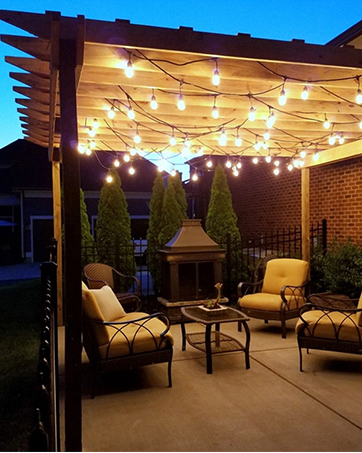
You are a GUI agent. You are given a task and a screenshot of the screen. Output one action in this format:
    pyautogui.click(x=<x>, y=<y>)
    Task: Click on the oven
    This screenshot has width=362, height=453.
    Given the screenshot: What is the action you would take?
    pyautogui.click(x=199, y=259)